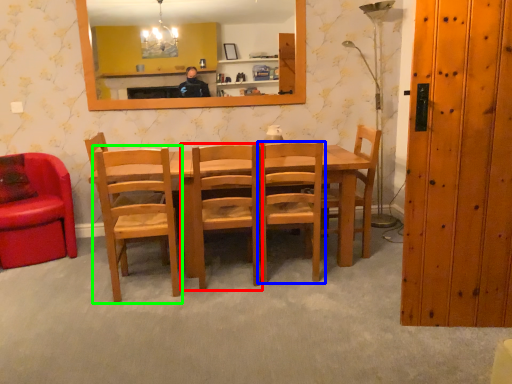
Question: Which object is the closest to the chair (highlighted by a red box)? Choose among these: chair (highlighted by a blue box) or chair (highlighted by a green box).

Choices:
 (A) chair
 (B) chair

Answer: (A)